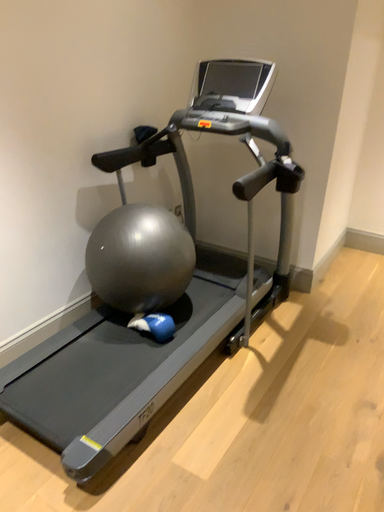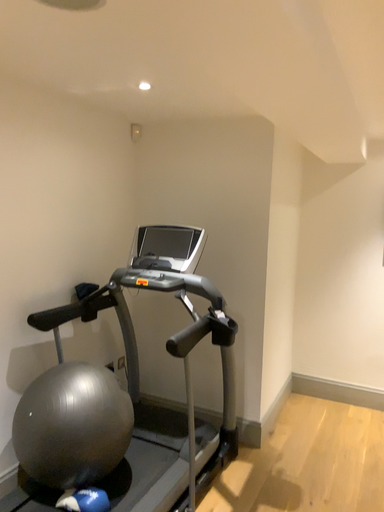
Question: Which way did the camera rotate in the video?

Choices:
 (A) rotated downward
 (B) rotated upward

Answer: (B)